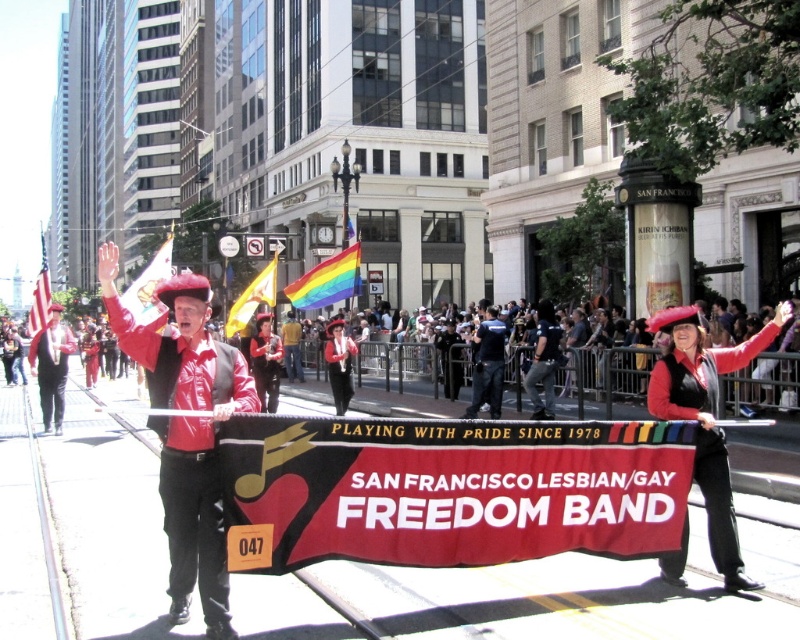
You are a photographer at the parade and want to capture both the matte black jacket at center and the american flag at left in a single frame. Given their sizes, which object should you focus on to ensure both are visible without cropping?

The matte black jacket at center occupies less space than the american flag at left, so focusing on the american flag at left will allow both objects to fit within the frame since it is the larger object.

You are a photographer at the Pride parade and want to capture the shiny red hat at center and the matte black jacket at center in the same frame. Based on their positions, which object should you focus on first to ensure both are in focus?

The matte black jacket at center is located above the shiny red hat at center. To ensure both are in focus, you should focus on the matte black jacket at center first since it is closer to the camera.